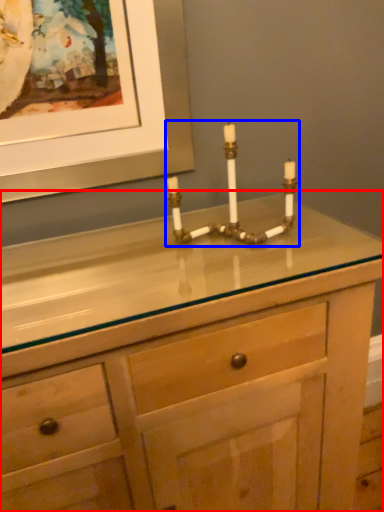
Question: Among these objects, which one is farthest to the camera, chest of drawers (highlighted by a red box) or candle holder (highlighted by a blue box)?

Choices:
 (A) chest of drawers
 (B) candle holder

Answer: (B)